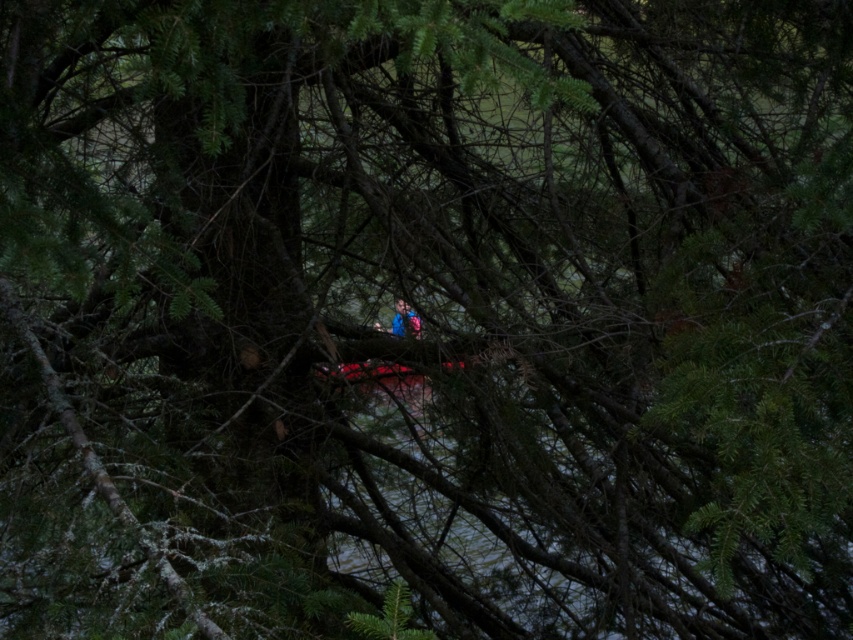
Is dark red wood canoe at center positioned before blue fabric at center?

No, it is not.

Describe the element at coordinates (370, 372) in the screenshot. I see `dark red wood canoe at center` at that location.

Find the location of a particular element. The width and height of the screenshot is (853, 640). dark red wood canoe at center is located at coordinates (370, 372).